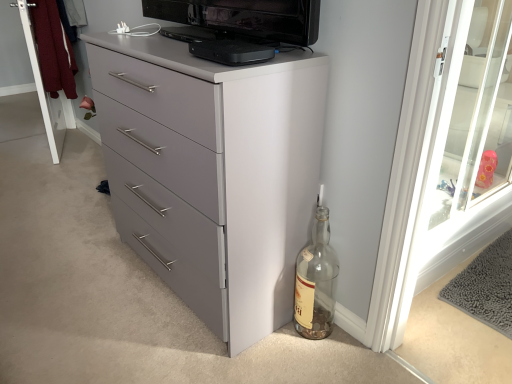
You are a GUI agent. You are given a task and a screenshot of the screen. Output one action in this format:
    pyautogui.click(x=<x>, y=<y>)
    Task: Click on the vacant space to the right of clear glass bottle at lower right
    The width and height of the screenshot is (512, 384).
    Given the screenshot: What is the action you would take?
    click(352, 343)